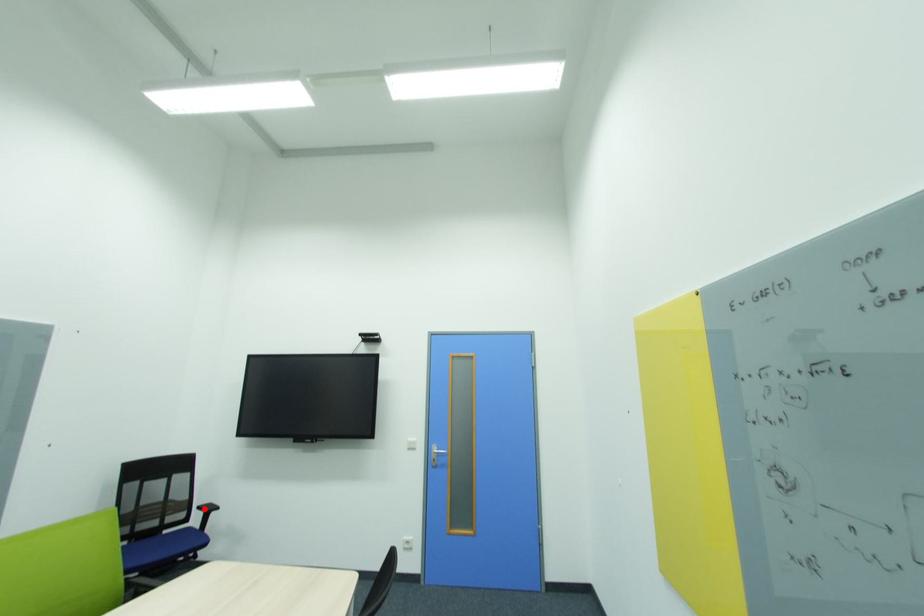
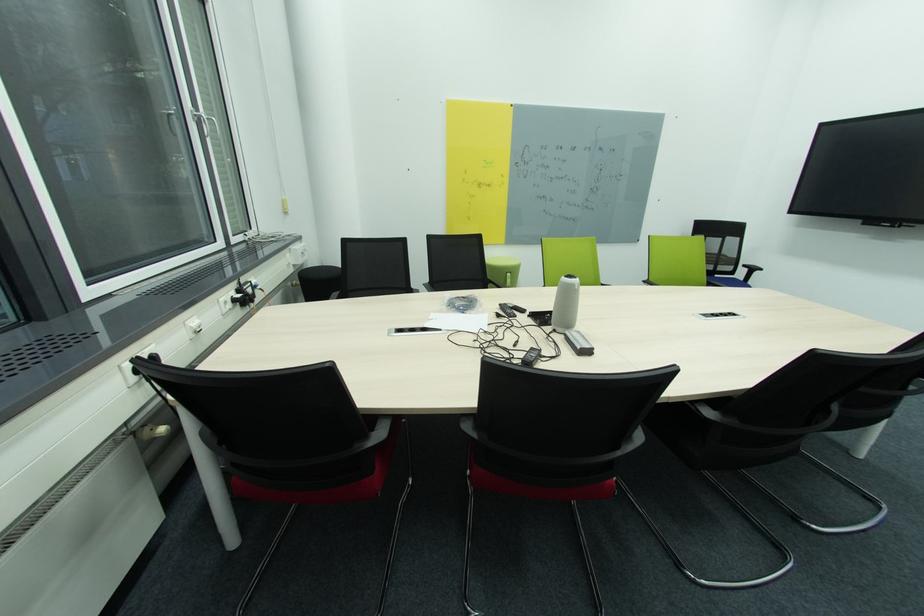
Question: I am providing you with two images of the same scene from different viewpoints. Given a red point in image1, look at the same physical point in image2. Is it:

Choices:
 (A) Closer to the viewpoint
 (B) Farther from the viewpoint

Answer: (B)